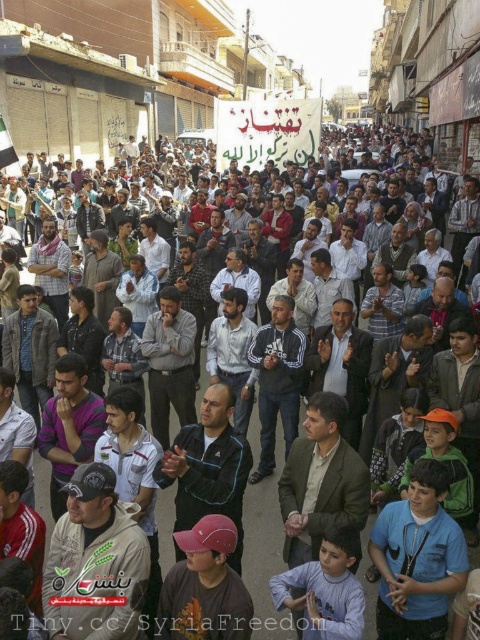
Question: Among these objects, which one is nearest to the camera?

Choices:
 (A) dark gray cap at center
 (B) blue fabric shirt at lower right

Answer: (A)

Question: Observing the image, what is the correct spatial positioning of dark gray cap at center in reference to blue fabric shirt at lower right?

Choices:
 (A) below
 (B) above

Answer: (B)

Question: Which object is closer to the camera taking this photo?

Choices:
 (A) blue fabric shirt at lower right
 (B) dark gray cap at center

Answer: (B)

Question: Where is dark gray cap at center located in relation to blue fabric shirt at lower right in the image?

Choices:
 (A) above
 (B) below

Answer: (A)

Question: Is dark gray cap at center above blue fabric shirt at lower right?

Choices:
 (A) no
 (B) yes

Answer: (B)